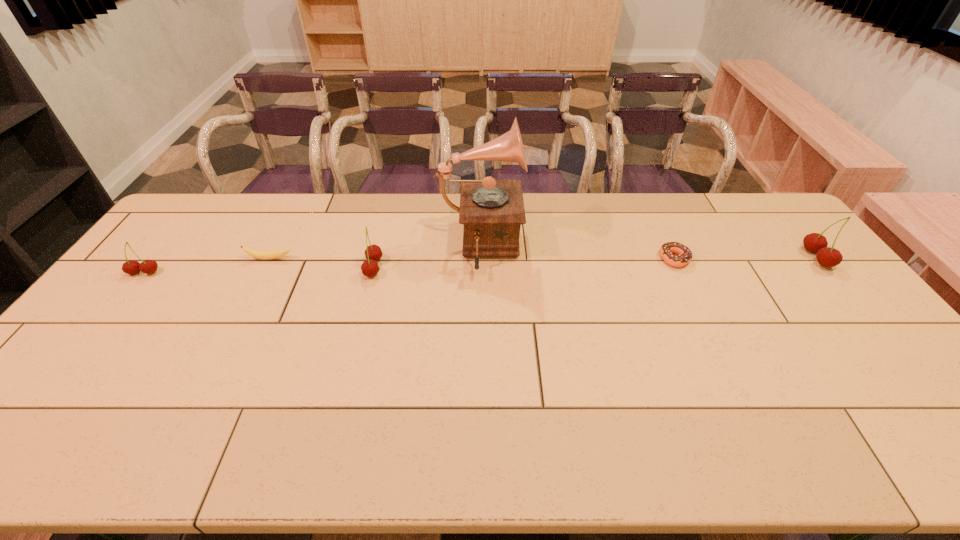
Please point a location where one more cherry can be added evenly. Please provide its 2D coordinates. Your answer should be formatted as a tuple, i.e. [(x, y)], where the tuple contains the x and y coordinates of a point satisfying the conditions above.

[(597, 263)]